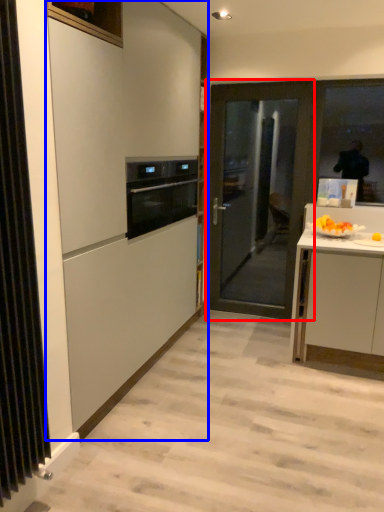
Question: Which object is closer to the camera taking this photo, door (highlighted by a red box) or cabinetry (highlighted by a blue box)?

Choices:
 (A) door
 (B) cabinetry

Answer: (B)